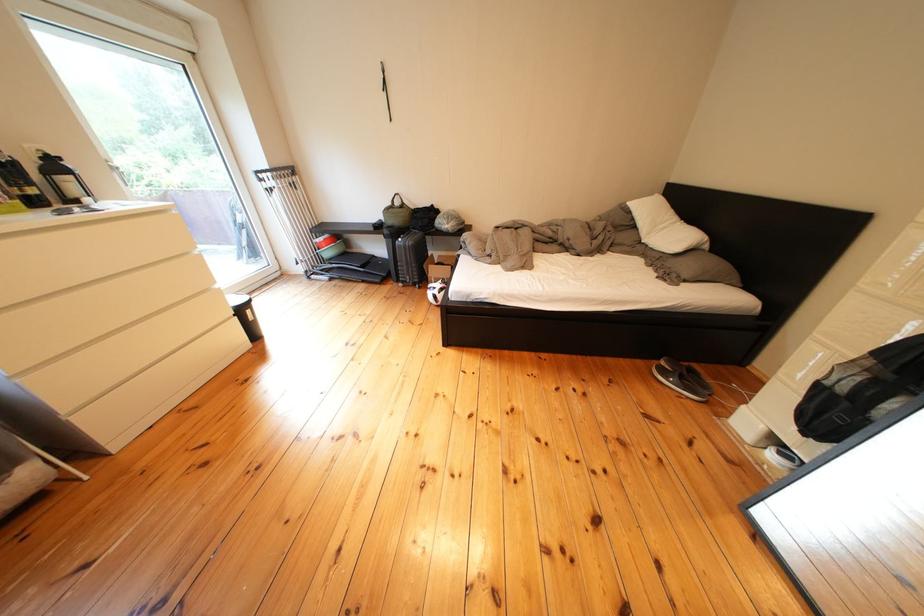
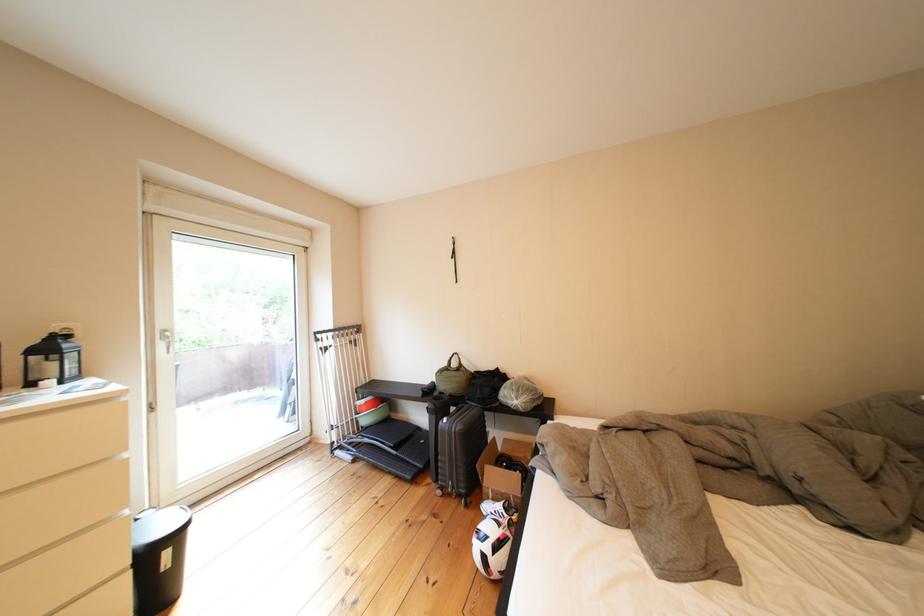
The point at (447,275) is marked in the first image. Where is the corresponding point in the second image?

(505, 480)